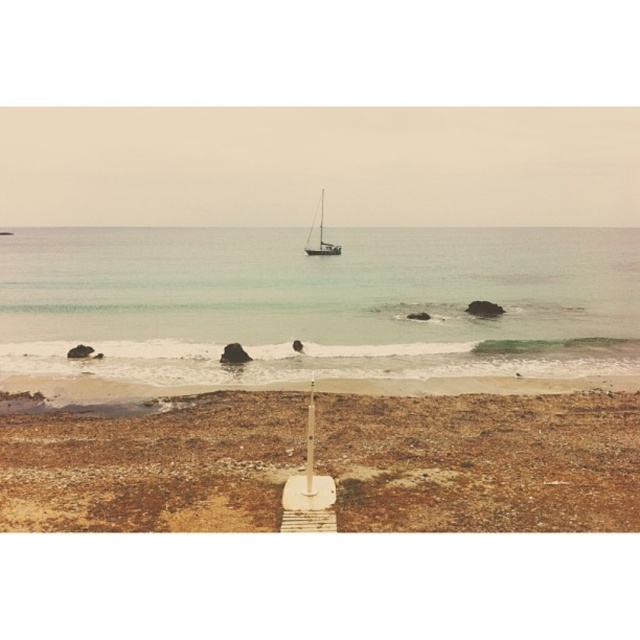
Does clear water at center have a greater width compared to brown sandy beach at lower left?

Correct, the width of clear water at center exceeds that of brown sandy beach at lower left.

Is point (442, 355) farther from viewer compared to point (269, 401)?

Yes, point (442, 355) is farther from viewer.

Between point (531, 356) and point (400, 433), which one is positioned in front?

Point (400, 433)

This screenshot has height=640, width=640. Find the location of `clear water at center`. clear water at center is located at coordinates (320, 301).